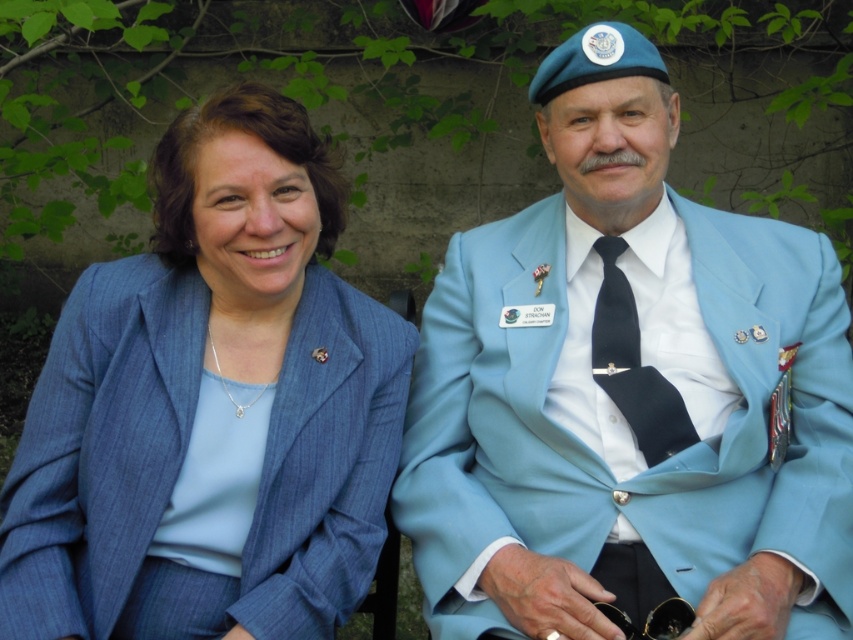
Question: Is light blue suit at center to the right of matte blue suit at left from the viewer's perspective?

Choices:
 (A) yes
 (B) no

Answer: (A)

Question: Does light blue suit at center appear over matte blue suit at left?

Choices:
 (A) yes
 (B) no

Answer: (A)

Question: Which point is closer to the camera?

Choices:
 (A) matte blue suit at left
 (B) light blue suit at center

Answer: (A)

Question: Can you confirm if light blue suit at center is wider than matte blue suit at left?

Choices:
 (A) no
 (B) yes

Answer: (B)